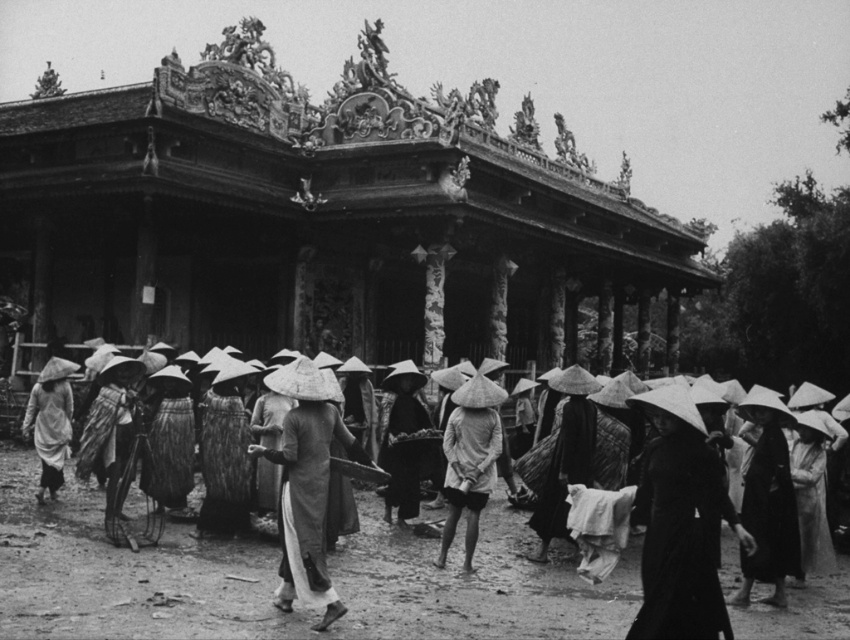
Does black matte conical hat at center have a larger size compared to matte gray robe at left?

Yes, black matte conical hat at center is bigger than matte gray robe at left.

Which of these two, black matte conical hat at center or matte gray robe at left, stands taller?

black matte conical hat at center

Who is more distant from viewer, (707, 502) or (23, 426)?

The point (23, 426) is more distant.

Where is `black matte conical hat at center`? black matte conical hat at center is located at coordinates (681, 524).

Who is more distant from viewer, (494, 388) or (51, 380)?

The point (51, 380) is more distant.

Is point (450, 445) farther from camera compared to point (60, 413)?

No.

Find the location of a particular element. matte white conical hat at center is located at coordinates (469, 460).

Can you confirm if matte straw hat at center is taller than white cotton ao dai at center?

Incorrect, matte straw hat at center's height is not larger of white cotton ao dai at center's.

This screenshot has height=640, width=850. Identify the location of matte straw hat at center. (275, 579).

Which is in front, point (439, 577) or point (320, 556)?

Point (320, 556) is in front.

The width and height of the screenshot is (850, 640). I want to click on matte straw hat at center, so [x=275, y=579].